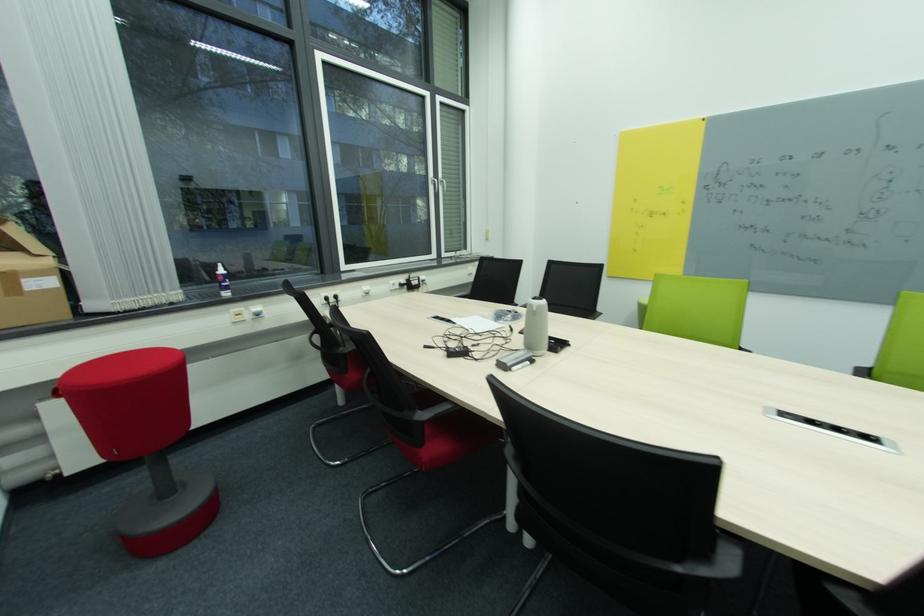
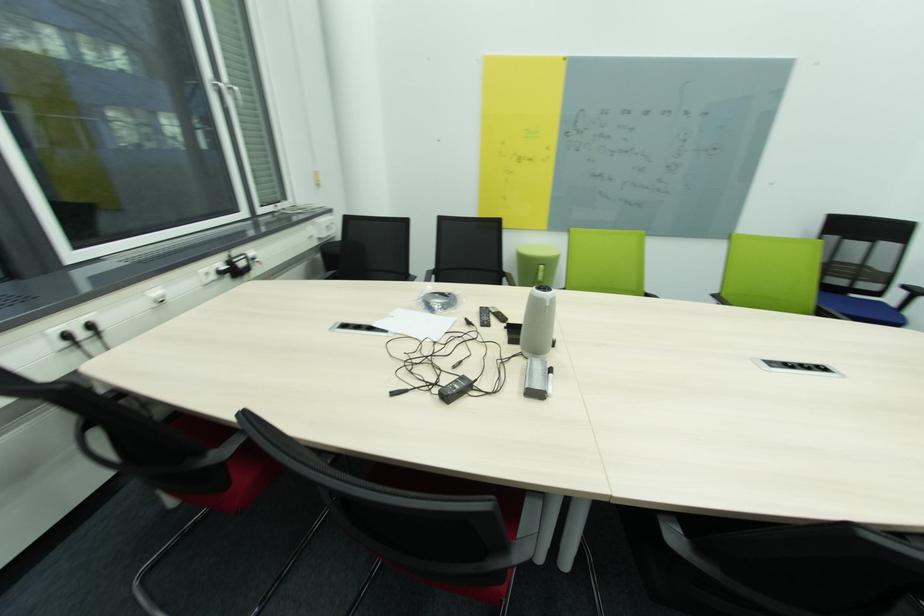
Question: Based on the continuous images, in which direction is the camera rotating? Reply with the corresponding letter.

Choices:
 (A) Left
 (B) Right
 (C) Up
 (D) Down

Answer: (B)